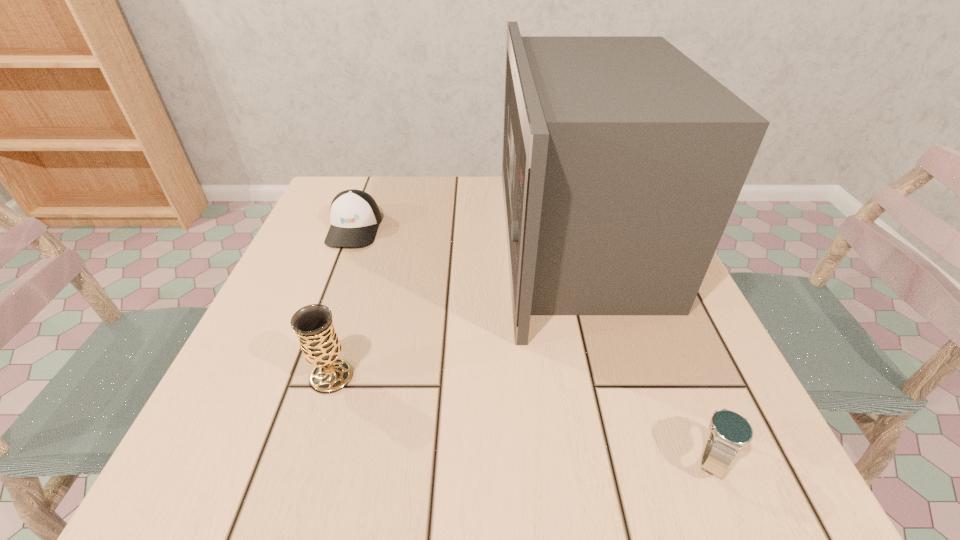
Image resolution: width=960 pixels, height=540 pixels. I want to click on vacant area that lies between the cap and the second tallest object, so click(x=343, y=302).

Find the location of a particular element. The width and height of the screenshot is (960, 540). empty space between the microwave oven and the chalice is located at coordinates (454, 309).

The image size is (960, 540). Identify the location of blank region between the second nearest object and the nearest object. (522, 417).

Where is `vacant area between the nearest object and the third shortest object`? vacant area between the nearest object and the third shortest object is located at coordinates (522, 417).

You are a GUI agent. You are given a task and a screenshot of the screen. Output one action in this format:
    pyautogui.click(x=<x>, y=<y>)
    Task: Click on the free point between the chalice and the watch
    
    Given the screenshot: What is the action you would take?
    pyautogui.click(x=522, y=417)

I want to click on unoccupied position between the second nearest object and the watch, so click(522, 417).

This screenshot has width=960, height=540. Find the location of `vacant space that's between the third farthest object and the tallest object`. vacant space that's between the third farthest object and the tallest object is located at coordinates (454, 309).

Identify the location of the second closest object to the cap. The height and width of the screenshot is (540, 960). (313, 324).

Select which object is the third closest to the cap. Please provide its 2D coordinates. Your answer should be formatted as a tuple, i.e. [(x, y)], where the tuple contains the x and y coordinates of a point satisfying the conditions above.

[(730, 431)]

Identify the location of vacant area that satisfies the following two spatial constraints: 1. on the front panel of the chalice; 2. on the left side of the cap. Image resolution: width=960 pixels, height=540 pixels. (299, 376).